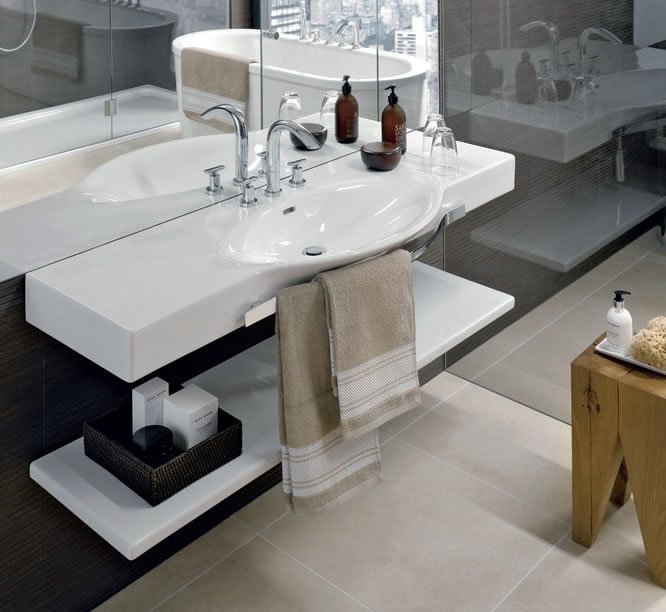
Locate an element on the screen. The width and height of the screenshot is (666, 612). white sink is located at coordinates (200, 267).